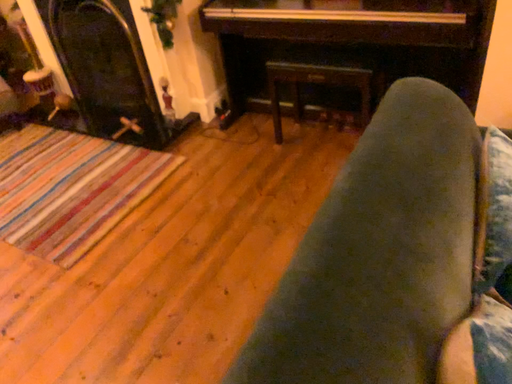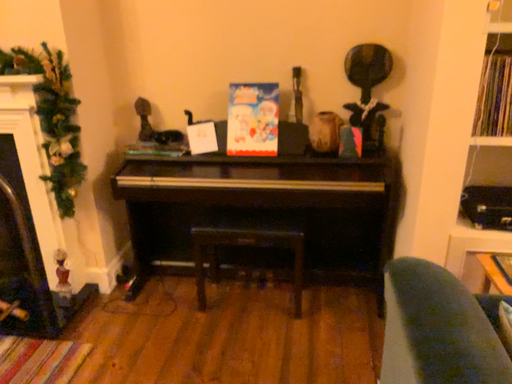
Question: Which way did the camera rotate in the video?

Choices:
 (A) rotated left
 (B) rotated right

Answer: (B)